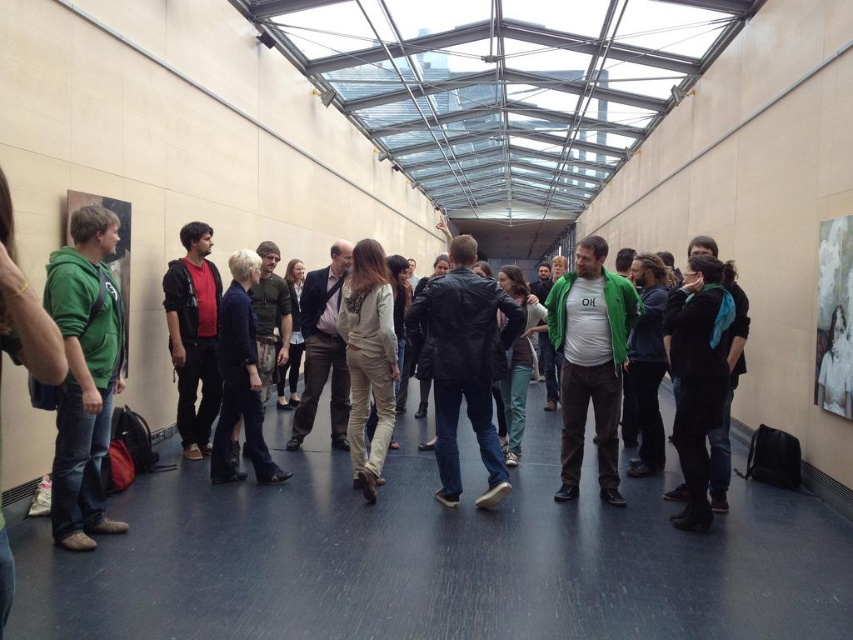
Question: Which object is positioned closest to the green fleece jacket at left?

Choices:
 (A) dark red hoodie at center
 (B) leather jacket at center

Answer: (A)

Question: Which object appears farthest from the camera in this image?

Choices:
 (A) dark red hoodie at center
 (B) leather jacket at center

Answer: (A)

Question: Can you confirm if leather jacket at center is positioned below dark red hoodie at center?

Choices:
 (A) yes
 (B) no

Answer: (A)

Question: Which object is the farthest from the green fleece jacket at left?

Choices:
 (A) leather jacket at center
 (B) dark red hoodie at center

Answer: (A)

Question: Observing the image, what is the correct spatial positioning of green fleece jacket at left in reference to leather jacket at center?

Choices:
 (A) right
 (B) left

Answer: (B)

Question: Is green fleece jacket at left smaller than dark red hoodie at center?

Choices:
 (A) no
 (B) yes

Answer: (A)